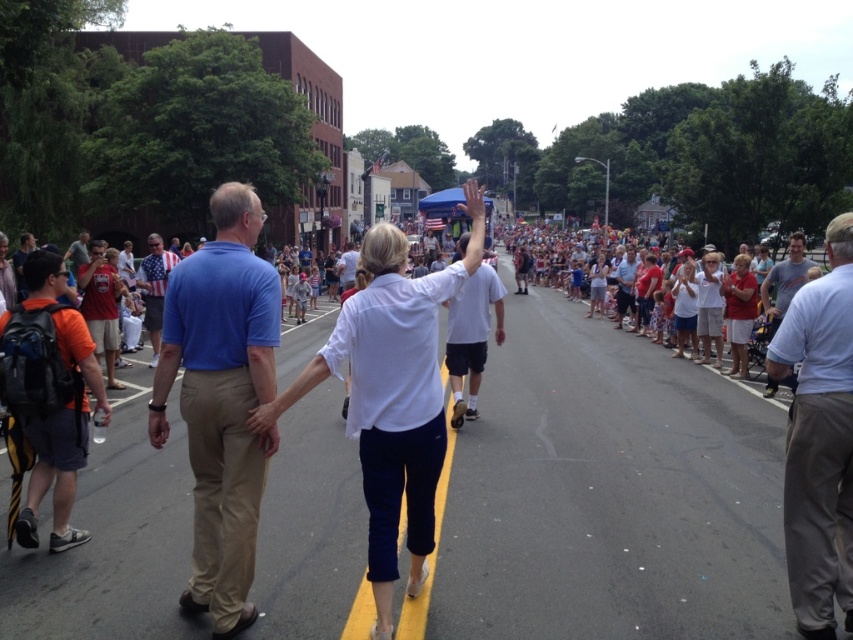
You are a photographer trying to capture both the blue cotton shirt at center and the american flag shirt at center in a single frame. Since you want to emphasize the larger shirt, which one should you focus on to ensure it appears bigger in the photo?

The american flag shirt at center is wider than the blue cotton shirt at center, so focusing on the american flag shirt at center will make it appear larger in the photo.

Based on the photo, you are a delivery person who needs to place a package between the orange fabric backpack at left and the american flag shirt at center. The package requires a space of 6 meters. Is there enough space?

The distance between the orange fabric backpack at left and the american flag shirt at center is 6.89 meters, so yes, there is enough space to place the package as the required 6 meters is less than the available distance.